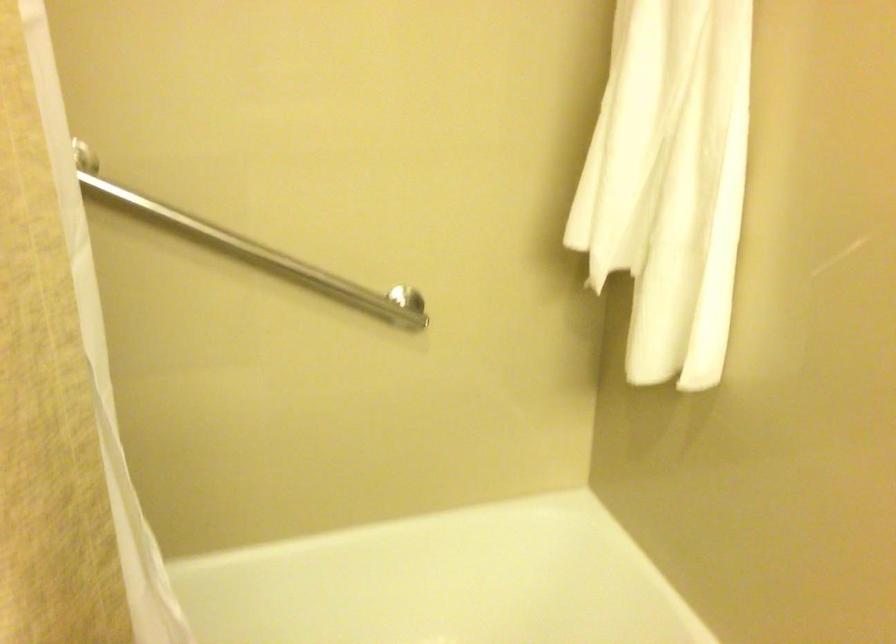
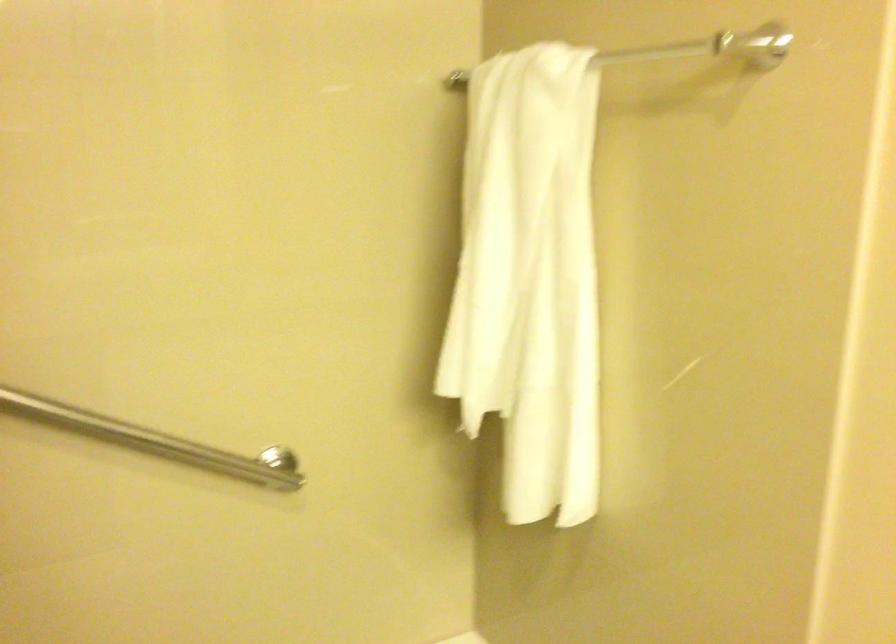
Question: The images are taken continuously from a first-person perspective. In which direction is your viewpoint rotating?

Choices:
 (A) Left
 (B) Right
 (C) Up
 (D) Down

Answer: (B)